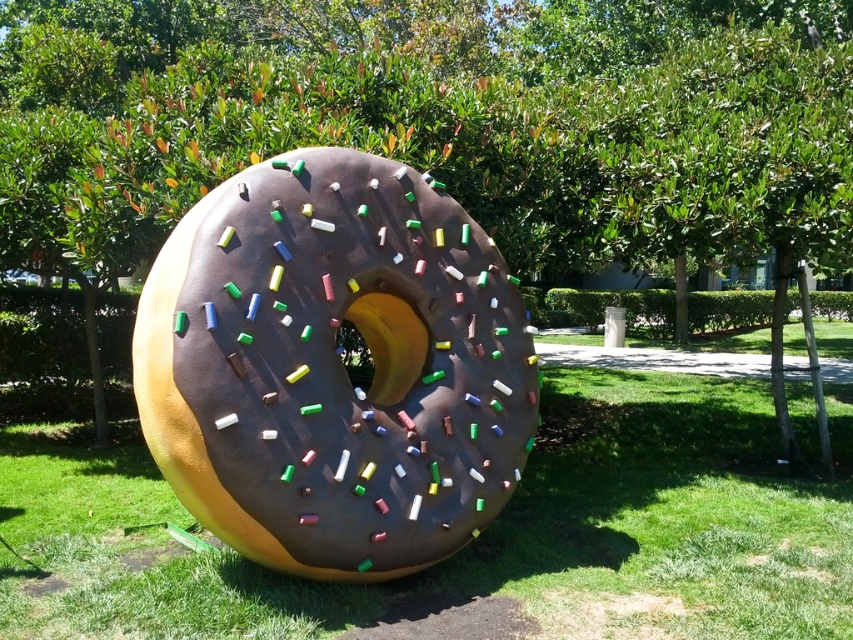
Who is taller, green leafy tree at center or chocolate-coated donut at center?

green leafy tree at center is taller.

Does green leafy tree at center have a lesser height compared to chocolate-coated donut at center?

No.

Is point (184, 141) positioned behind point (316, 156)?

Yes, it is.

At what (x,y) coordinates should I click in order to perform the action: click on green leafy tree at center. Please return your answer as a coordinate pair (x, y). Looking at the image, I should click on (451, 124).

Is green leafy tree at center taller than green grass at center?

Yes.

Between green leafy tree at center and green grass at center, which one is positioned lower?

Positioned lower is green grass at center.

Describe the element at coordinates (451, 124) in the screenshot. I see `green leafy tree at center` at that location.

Locate an element on the screen. green leafy tree at center is located at coordinates (451, 124).

Which is behind, point (796, 518) or point (492, 291)?

Positioned behind is point (796, 518).

Is green grass at center smaller than chocolate-coated donut at center?

No.

This screenshot has width=853, height=640. Find the location of `green grass at center`. green grass at center is located at coordinates (477, 538).

The height and width of the screenshot is (640, 853). In order to click on green grass at center in this screenshot , I will do `click(477, 538)`.